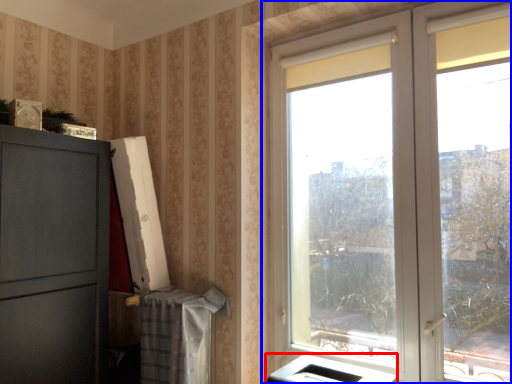
Question: Among these objects, which one is farthest to the camera, appliance (highlighted by a red box) or window (highlighted by a blue box)?

Choices:
 (A) appliance
 (B) window

Answer: (A)